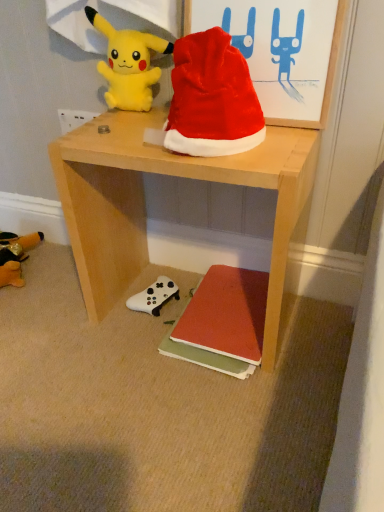
Question: Visually, is light wood desk at center positioned to the left or to the right of yellow plush at upper left?

Choices:
 (A) right
 (B) left

Answer: (A)

Question: Choose the correct answer: Is light wood desk at center inside yellow plush at upper left or outside it?

Choices:
 (A) inside
 (B) outside

Answer: (B)

Question: Which object is the closest to the red matte book at lower center?

Choices:
 (A) light wood desk at center
 (B) red velvet santa hat at upper center
 (C) yellow plush at upper left
 (D) white plastic power outlet at upper left

Answer: (A)

Question: Which of these objects is positioned closest to the red matte book at lower center?

Choices:
 (A) white plastic power outlet at upper left
 (B) light wood desk at center
 (C) yellow plush at upper left
 (D) red velvet santa hat at upper center

Answer: (B)